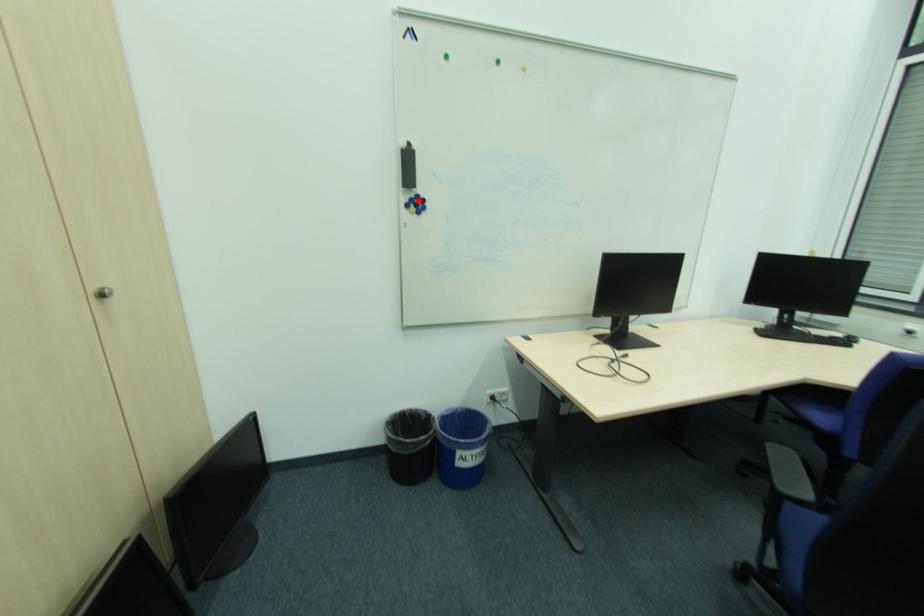
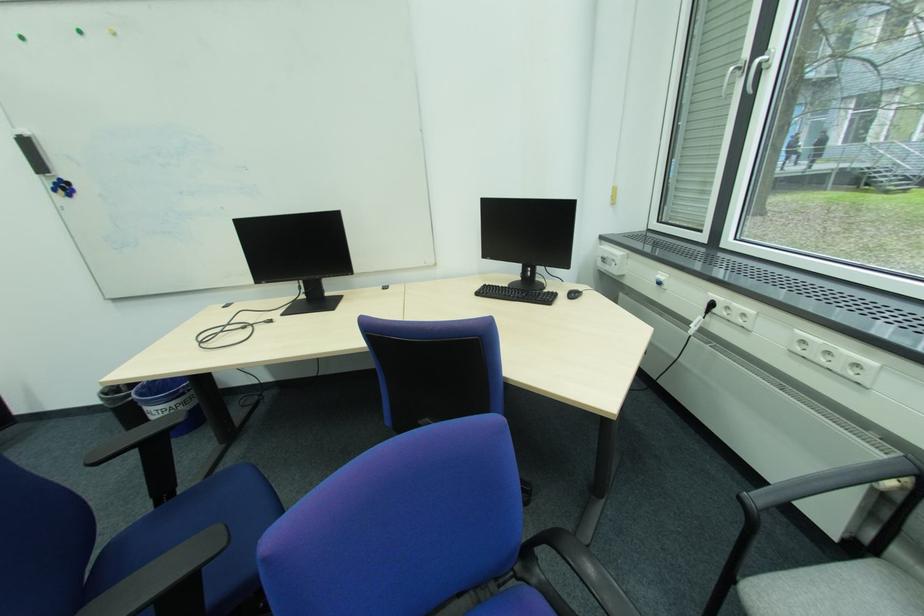
Question: I am providing you with two images of the same scene from different viewpoints. Image1 has a red point marked. In image2, the corresponding 3D location appears at what relative position? Reply with the corresponding letter.

Choices:
 (A) Closer
 (B) Farther

Answer: (B)